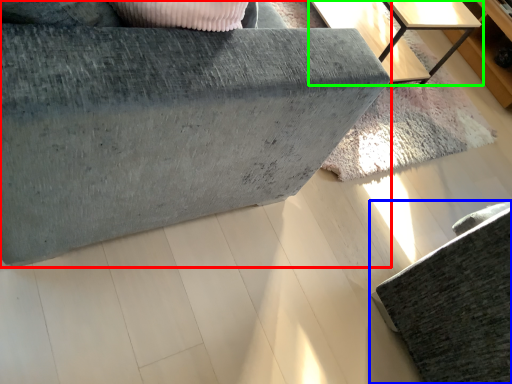
Question: Based on their relative distances, which object is nearer to furniture (highlighted by a red box)? Choose from furniture (highlighted by a blue box) and table (highlighted by a green box).

Choices:
 (A) furniture
 (B) table

Answer: (A)